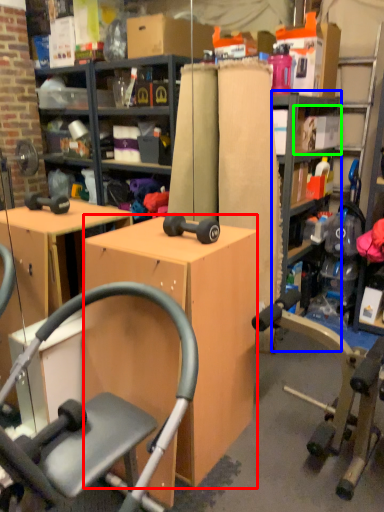
Question: Which object is positioned closest to desk (highlighted by a red box)? Select from bookshelf (highlighted by a blue box) and shelf (highlighted by a green box).

Choices:
 (A) bookshelf
 (B) shelf

Answer: (A)